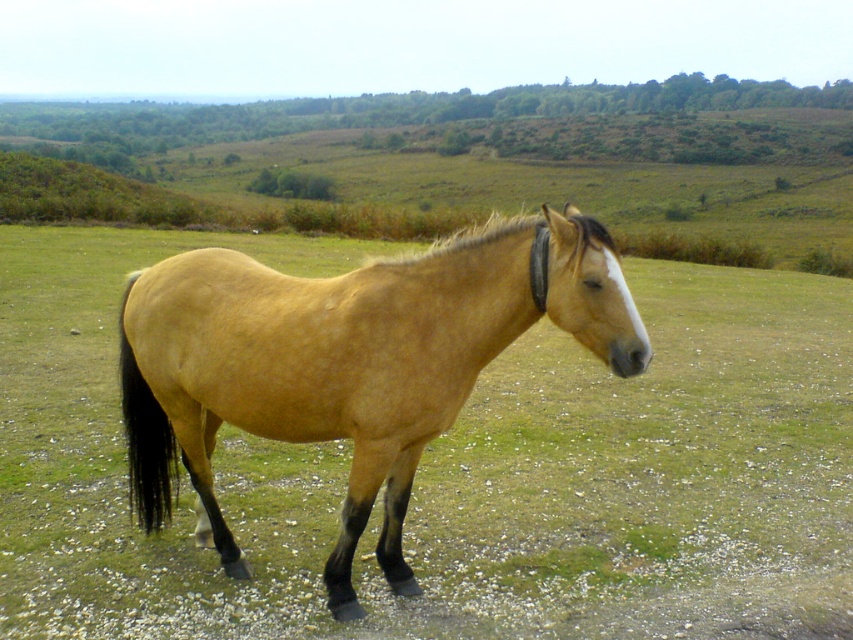
Question: Which point is closer to the camera taking this photo?

Choices:
 (A) (231, 368)
 (B) (450, 244)

Answer: (B)

Question: Is golden matte horse at center further to the viewer compared to golden smooth mane at center?

Choices:
 (A) no
 (B) yes

Answer: (A)

Question: Can you confirm if golden matte horse at center is positioned below golden smooth mane at center?

Choices:
 (A) yes
 (B) no

Answer: (A)

Question: Does golden matte horse at center have a smaller size compared to golden smooth mane at center?

Choices:
 (A) no
 (B) yes

Answer: (B)